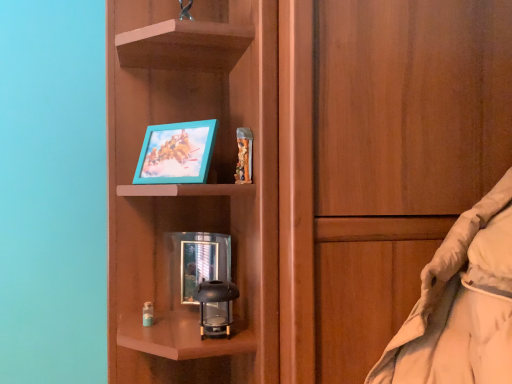
What do you see at coordinates (176, 153) in the screenshot? I see `teal plastic picture frame at upper center, which ranks as the second picture frame in bottom-to-top order` at bounding box center [176, 153].

At what (x,y) coordinates should I click in order to perform the action: click on teal plastic picture frame at upper center, positioned as the 1th picture frame in top-to-bottom order. Please return your answer as a coordinate pair (x, y). The height and width of the screenshot is (384, 512). Looking at the image, I should click on 176,153.

How much space does teal plastic picture frame at upper center, which ranks as the second picture frame in bottom-to-top order, occupy vertically?

The height of teal plastic picture frame at upper center, which ranks as the second picture frame in bottom-to-top order, is 7.56 inches.

Where is `metallic reflective picture frame at center, the 2th picture frame positioned from the top`? The height and width of the screenshot is (384, 512). metallic reflective picture frame at center, the 2th picture frame positioned from the top is located at coordinates (195, 263).

Measure the distance between metallic reflective picture frame at center, the 2th picture frame positioned from the top, and camera.

metallic reflective picture frame at center, the 2th picture frame positioned from the top, is 3.45 feet away from camera.

The height and width of the screenshot is (384, 512). Describe the element at coordinates (195, 263) in the screenshot. I see `metallic reflective picture frame at center, the 2th picture frame positioned from the top` at that location.

Where is `teal plastic picture frame at upper center, positioned as the 1th picture frame in top-to-bottom order`? Image resolution: width=512 pixels, height=384 pixels. teal plastic picture frame at upper center, positioned as the 1th picture frame in top-to-bottom order is located at coordinates (176, 153).

Does metallic reflective picture frame at center, the 2th picture frame positioned from the top, appear on the right side of teal plastic picture frame at upper center, which ranks as the second picture frame in bottom-to-top order?

Correct, you'll find metallic reflective picture frame at center, the 2th picture frame positioned from the top, to the right of teal plastic picture frame at upper center, which ranks as the second picture frame in bottom-to-top order.

Looking at this image, is metallic reflective picture frame at center, the 2th picture frame positioned from the top, positioned behind teal plastic picture frame at upper center, which ranks as the second picture frame in bottom-to-top order?

That is True.

Between point (181, 305) and point (197, 172), which one is positioned behind?

The point (181, 305) is more distant.

From the image's perspective, is metallic reflective picture frame at center, which is the 1th picture frame from bottom to top, above teal plastic picture frame at upper center, which ranks as the second picture frame in bottom-to-top order?

Incorrect, from the image's perspective, metallic reflective picture frame at center, which is the 1th picture frame from bottom to top, is lower than teal plastic picture frame at upper center, which ranks as the second picture frame in bottom-to-top order.

From a real-world perspective, is metallic reflective picture frame at center, the 2th picture frame positioned from the top, positioned above or below teal plastic picture frame at upper center, positioned as the 1th picture frame in top-to-bottom order?

Clearly, from a real-world perspective, metallic reflective picture frame at center, the 2th picture frame positioned from the top, is below teal plastic picture frame at upper center, positioned as the 1th picture frame in top-to-bottom order.

Does metallic reflective picture frame at center, which is the 1th picture frame from bottom to top, have a greater width compared to teal plastic picture frame at upper center, which ranks as the second picture frame in bottom-to-top order?

No.

Looking at this image, can you confirm if metallic reflective picture frame at center, the 2th picture frame positioned from the top, is shorter than teal plastic picture frame at upper center, positioned as the 1th picture frame in top-to-bottom order?

No, metallic reflective picture frame at center, the 2th picture frame positioned from the top, is not shorter than teal plastic picture frame at upper center, positioned as the 1th picture frame in top-to-bottom order.

Is metallic reflective picture frame at center, which is the 1th picture frame from bottom to top, bigger or smaller than teal plastic picture frame at upper center, which ranks as the second picture frame in bottom-to-top order?

In the image, metallic reflective picture frame at center, which is the 1th picture frame from bottom to top, appears to be smaller than teal plastic picture frame at upper center, which ranks as the second picture frame in bottom-to-top order.

Is metallic reflective picture frame at center, the 2th picture frame positioned from the top, spatially inside teal plastic picture frame at upper center, positioned as the 1th picture frame in top-to-bottom order, or outside of it?

metallic reflective picture frame at center, the 2th picture frame positioned from the top, lies outside teal plastic picture frame at upper center, positioned as the 1th picture frame in top-to-bottom order.

Is metallic reflective picture frame at center, the 2th picture frame positioned from the top, positioned far away from teal plastic picture frame at upper center, positioned as the 1th picture frame in top-to-bottom order?

metallic reflective picture frame at center, the 2th picture frame positioned from the top, is actually quite close to teal plastic picture frame at upper center, positioned as the 1th picture frame in top-to-bottom order.

Is metallic reflective picture frame at center, which is the 1th picture frame from bottom to top, oriented away from teal plastic picture frame at upper center, positioned as the 1th picture frame in top-to-bottom order?

metallic reflective picture frame at center, which is the 1th picture frame from bottom to top, is not turned away from teal plastic picture frame at upper center, positioned as the 1th picture frame in top-to-bottom order.

You are a GUI agent. You are given a task and a screenshot of the screen. Output one action in this format:
    pyautogui.click(x=<x>, y=<y>)
    Task: Click on the picture frame below the teal plastic picture frame at upper center, positioned as the 1th picture frame in top-to-bottom order (from a real-world perspective)
    This screenshot has height=384, width=512.
    Given the screenshot: What is the action you would take?
    pyautogui.click(x=195, y=263)

Between teal plastic picture frame at upper center, positioned as the 1th picture frame in top-to-bottom order, and metallic reflective picture frame at center, the 2th picture frame positioned from the top, which one appears on the left side from the viewer's perspective?

teal plastic picture frame at upper center, positioned as the 1th picture frame in top-to-bottom order, is more to the left.

Is the position of teal plastic picture frame at upper center, which ranks as the second picture frame in bottom-to-top order, less distant than that of metallic reflective picture frame at center, the 2th picture frame positioned from the top?

Yes, the depth of teal plastic picture frame at upper center, which ranks as the second picture frame in bottom-to-top order, is less than that of metallic reflective picture frame at center, the 2th picture frame positioned from the top.

Does point (187, 147) come behind point (181, 280)?

No, it is in front of (181, 280).

From the image's perspective, who appears lower, teal plastic picture frame at upper center, which ranks as the second picture frame in bottom-to-top order, or metallic reflective picture frame at center, the 2th picture frame positioned from the top?

metallic reflective picture frame at center, the 2th picture frame positioned from the top, appears lower in the image.

From a real-world perspective, which object stands above the other?

From a 3D spatial view, teal plastic picture frame at upper center, which ranks as the second picture frame in bottom-to-top order, is above.

Consider the image. Which of these two, teal plastic picture frame at upper center, positioned as the 1th picture frame in top-to-bottom order, or metallic reflective picture frame at center, which is the 1th picture frame from bottom to top, is wider?

teal plastic picture frame at upper center, positioned as the 1th picture frame in top-to-bottom order.

Which of these two, teal plastic picture frame at upper center, which ranks as the second picture frame in bottom-to-top order, or metallic reflective picture frame at center, which is the 1th picture frame from bottom to top, stands taller?

metallic reflective picture frame at center, which is the 1th picture frame from bottom to top, is taller.

Who is smaller, teal plastic picture frame at upper center, positioned as the 1th picture frame in top-to-bottom order, or metallic reflective picture frame at center, which is the 1th picture frame from bottom to top?

Smaller between the two is metallic reflective picture frame at center, which is the 1th picture frame from bottom to top.

Is teal plastic picture frame at upper center, positioned as the 1th picture frame in top-to-bottom order, completely or partially outside of metallic reflective picture frame at center, the 2th picture frame positioned from the top?

Yes, teal plastic picture frame at upper center, positioned as the 1th picture frame in top-to-bottom order, is outside of metallic reflective picture frame at center, the 2th picture frame positioned from the top.

Is teal plastic picture frame at upper center, which ranks as the second picture frame in bottom-to-top order, placed right next to metallic reflective picture frame at center, the 2th picture frame positioned from the top?

teal plastic picture frame at upper center, which ranks as the second picture frame in bottom-to-top order, and metallic reflective picture frame at center, the 2th picture frame positioned from the top, are not in contact.

Is teal plastic picture frame at upper center, positioned as the 1th picture frame in top-to-bottom order, oriented away from metallic reflective picture frame at center, which is the 1th picture frame from bottom to top?

No, teal plastic picture frame at upper center, positioned as the 1th picture frame in top-to-bottom order, is not facing away from metallic reflective picture frame at center, which is the 1th picture frame from bottom to top.

In the scene shown: How distant is teal plastic picture frame at upper center, positioned as the 1th picture frame in top-to-bottom order, from metallic reflective picture frame at center, which is the 1th picture frame from bottom to top?

The distance of teal plastic picture frame at upper center, positioned as the 1th picture frame in top-to-bottom order, from metallic reflective picture frame at center, which is the 1th picture frame from bottom to top, is 24.36 centimeters.

Locate an element on the screen. picture frame that is under the teal plastic picture frame at upper center, which ranks as the second picture frame in bottom-to-top order (from a real-world perspective) is located at coordinates (195, 263).

Where is `picture frame in front of the metallic reflective picture frame at center, the 2th picture frame positioned from the top`? This screenshot has height=384, width=512. picture frame in front of the metallic reflective picture frame at center, the 2th picture frame positioned from the top is located at coordinates point(176,153).

I want to click on picture frame below the teal plastic picture frame at upper center, positioned as the 1th picture frame in top-to-bottom order (from a real-world perspective), so click(195, 263).